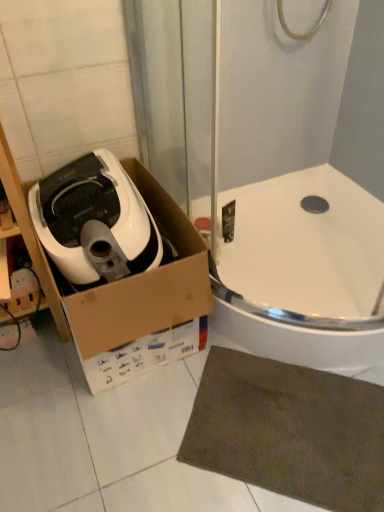
Question: Does brown textured bath mat at lower right have a lesser height compared to white cardboard box at left?

Choices:
 (A) no
 (B) yes

Answer: (B)

Question: Is brown textured bath mat at lower right further to the viewer compared to white cardboard box at left?

Choices:
 (A) no
 (B) yes

Answer: (B)

Question: Considering the relative sizes of brown textured bath mat at lower right and white cardboard box at left in the image provided, is brown textured bath mat at lower right thinner than white cardboard box at left?

Choices:
 (A) no
 (B) yes

Answer: (B)

Question: From a real-world perspective, is brown textured bath mat at lower right located beneath white cardboard box at left?

Choices:
 (A) no
 (B) yes

Answer: (B)

Question: Is brown textured bath mat at lower right with white cardboard box at left?

Choices:
 (A) no
 (B) yes

Answer: (A)

Question: Is brown textured bath mat at lower right taller than white cardboard box at left?

Choices:
 (A) yes
 (B) no

Answer: (B)

Question: Is white cardboard box at left with white glossy bath at center?

Choices:
 (A) no
 (B) yes

Answer: (A)

Question: Can you confirm if white cardboard box at left is thinner than white glossy bath at center?

Choices:
 (A) no
 (B) yes

Answer: (B)

Question: Is the position of white cardboard box at left more distant than that of white glossy bath at center?

Choices:
 (A) no
 (B) yes

Answer: (A)

Question: Can you confirm if white cardboard box at left is positioned to the left of white glossy bath at center?

Choices:
 (A) no
 (B) yes

Answer: (B)

Question: Is white cardboard box at left taller than white glossy bath at center?

Choices:
 (A) no
 (B) yes

Answer: (B)

Question: From the image's perspective, is white cardboard box at left located above white glossy bath at center?

Choices:
 (A) yes
 (B) no

Answer: (B)

Question: From a real-world perspective, is white matte air fryer at left below white glossy bath at center?

Choices:
 (A) no
 (B) yes

Answer: (A)